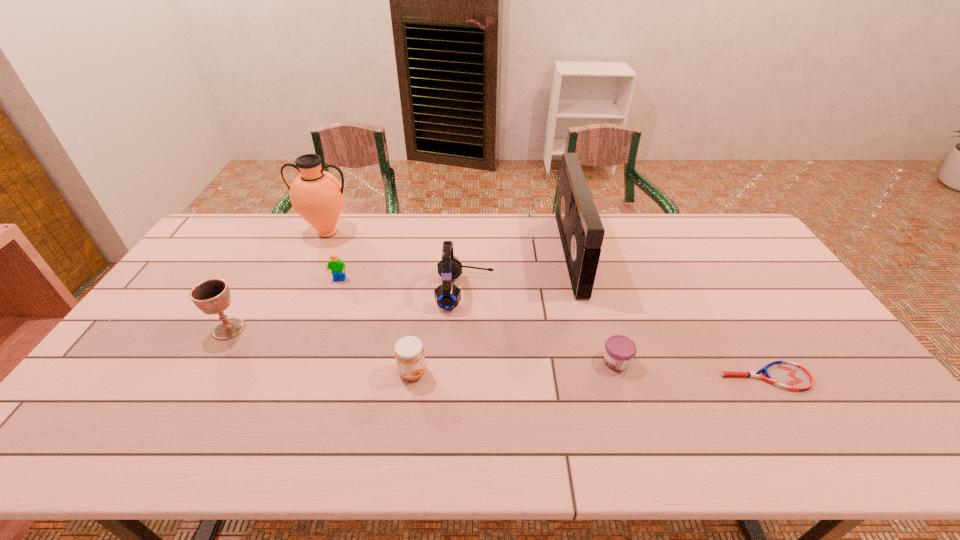
Locate an element on the screen. The width and height of the screenshot is (960, 540). free space at the left edge of the desktop is located at coordinates (174, 362).

In the image, there is a desktop. Find the location of `vacant space at the right edge`. vacant space at the right edge is located at coordinates (754, 278).

Where is `blank space at the far left corner`? blank space at the far left corner is located at coordinates (256, 215).

You are a GUI agent. You are given a task and a screenshot of the screen. Output one action in this format:
    pyautogui.click(x=<x>, y=<y>)
    Task: Click on the free space at the far right corner of the desktop
    This screenshot has width=960, height=540.
    Given the screenshot: What is the action you would take?
    pyautogui.click(x=753, y=248)

Where is `vacant area that lies between the videotape and the fifth object from right to left`? This screenshot has width=960, height=540. vacant area that lies between the videotape and the fifth object from right to left is located at coordinates (492, 313).

The width and height of the screenshot is (960, 540). I want to click on empty space that is in between the shorter jam and the Lego, so click(478, 321).

Identify the location of vacant area that lies between the Lego and the taller jam. (376, 326).

Locate an element on the screen. The width and height of the screenshot is (960, 540). blank region between the videotape and the fourth object from right to left is located at coordinates (518, 272).

Identify the location of vacant space in between the fifth object from right to left and the Lego. The width and height of the screenshot is (960, 540). (376, 326).

What are the coordinates of `free space between the pitcher and the third tallest object` in the screenshot? It's located at (396, 262).